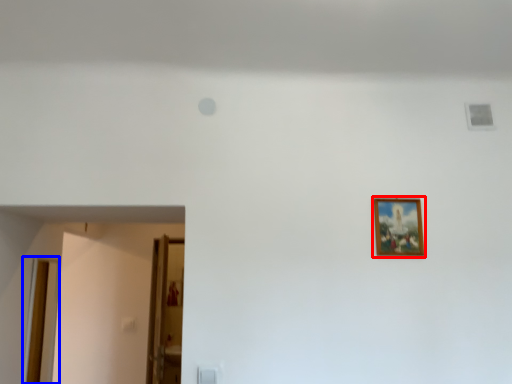
Question: Which object appears closest to the camera in this image, picture frame (highlighted by a red box) or door (highlighted by a blue box)?

Choices:
 (A) picture frame
 (B) door

Answer: (A)